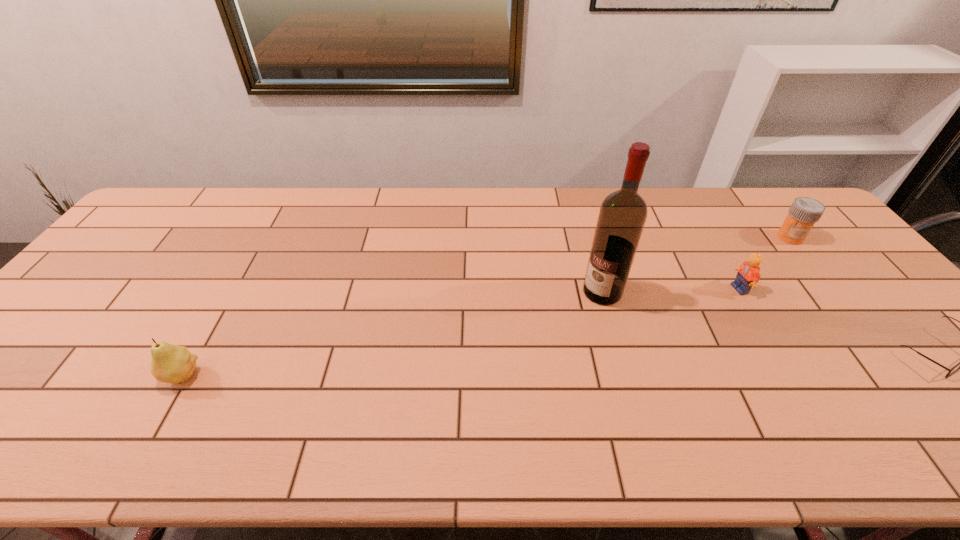
You are a GUI agent. You are given a task and a screenshot of the screen. Output one action in this format:
    pyautogui.click(x=<x>, y=<y>)
    Task: Click on the free location at the right edge of the desktop
    The image size is (960, 540).
    Given the screenshot: What is the action you would take?
    pyautogui.click(x=878, y=334)

Where is `unoccupied position between the pear and the medicine`? The width and height of the screenshot is (960, 540). unoccupied position between the pear and the medicine is located at coordinates (486, 307).

This screenshot has width=960, height=540. I want to click on free space that is in between the alcohol and the Lego, so click(x=671, y=291).

Identify the location of free space between the pear and the third object from right to left. (461, 332).

In order to click on vacant region between the pear and the farthest object in this screenshot , I will do `click(486, 307)`.

Locate an element on the screen. The height and width of the screenshot is (540, 960). object that is the fourth closest to the spectacles is located at coordinates (173, 364).

Identify which object is located as the fourth nearest to the tallest object. Please provide its 2D coordinates. Your answer should be formatted as a tuple, i.e. [(x, y)], where the tuple contains the x and y coordinates of a point satisfying the conditions above.

[(173, 364)]

At what (x,y) coordinates should I click in order to perform the action: click on blank space that satisfies the following two spatial constraints: 1. on the back side of the alcohol; 2. on the left side of the pear. Please return your answer as a coordinate pair (x, y). This screenshot has height=540, width=960. Looking at the image, I should click on (229, 292).